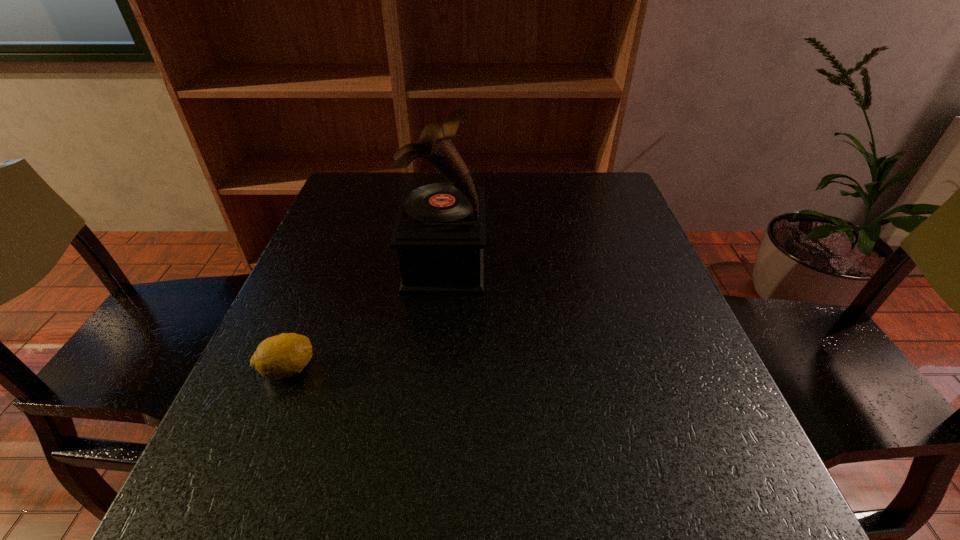
This screenshot has width=960, height=540. What are the coordinates of `phonograph_record` in the screenshot? It's located at (439, 233).

The width and height of the screenshot is (960, 540). I want to click on the farther object, so click(439, 233).

I want to click on the shorter object, so click(280, 356).

Locate an element on the screen. This screenshot has width=960, height=540. the nearer object is located at coordinates (280, 356).

Find the location of `vacant space located 0.390m at the horn opening of the taller object`. vacant space located 0.390m at the horn opening of the taller object is located at coordinates (656, 262).

Where is `vacant area situated at the stem end of the lemon`? The image size is (960, 540). vacant area situated at the stem end of the lemon is located at coordinates (373, 369).

Where is `object present at the left edge`? The width and height of the screenshot is (960, 540). object present at the left edge is located at coordinates (280, 356).

The width and height of the screenshot is (960, 540). I want to click on free space at the far edge, so 478,173.

I want to click on free location at the near edge of the desktop, so click(x=612, y=502).

The image size is (960, 540). I want to click on free space at the right edge of the desktop, so click(x=641, y=253).